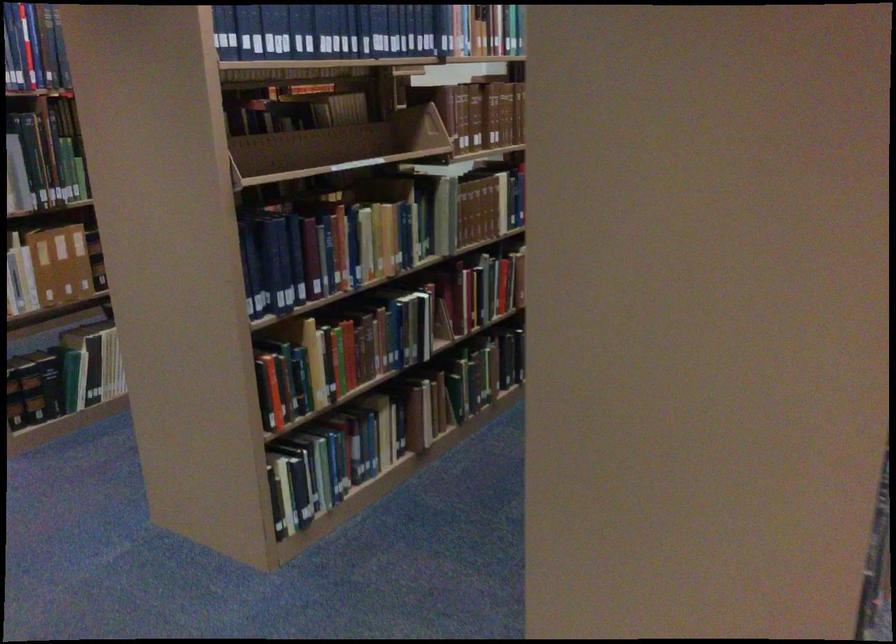
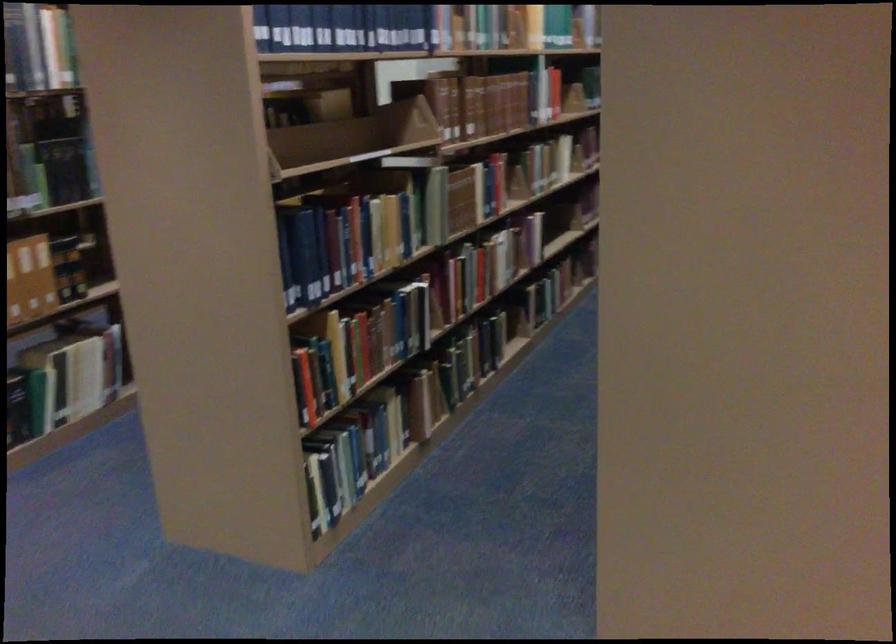
Question: The images are taken continuously from a first-person perspective. In which direction are you moving?

Choices:
 (A) Left
 (B) Right
 (C) Forward
 (D) Backward

Answer: (A)